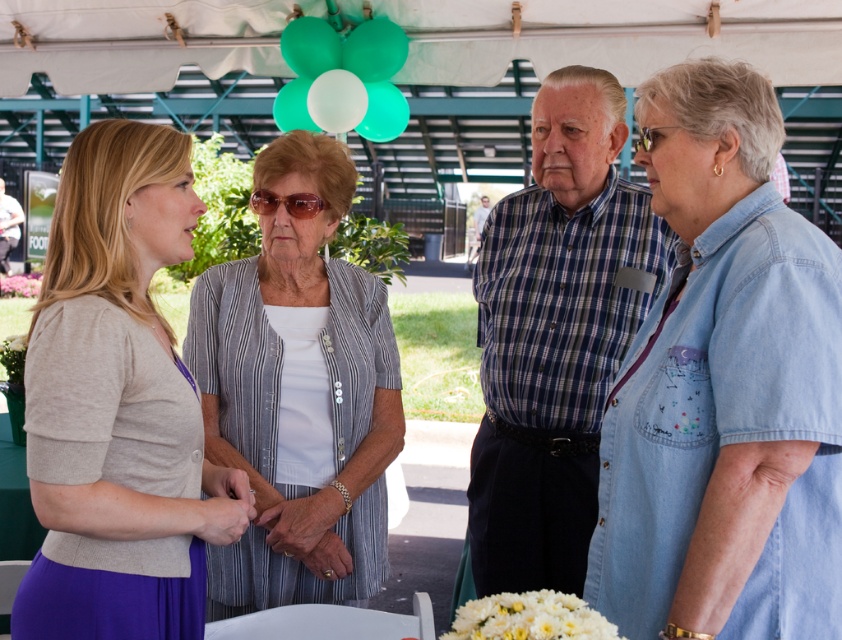
Can you confirm if striped fabric blouse at center is thinner than plaid shirt at center?

No, striped fabric blouse at center is not thinner than plaid shirt at center.

This screenshot has width=842, height=640. What do you see at coordinates (297, 392) in the screenshot? I see `striped fabric blouse at center` at bounding box center [297, 392].

Is point (400, 410) farther from viewer compared to point (499, 312)?

No.

Where is `striped fabric blouse at center`? This screenshot has height=640, width=842. striped fabric blouse at center is located at coordinates (297, 392).

Who is positioned more to the left, matte beige cardigan at left or matte blue shirt at center?

matte blue shirt at center is more to the left.

Between point (30, 632) and point (13, 211), which one is positioned behind?

Positioned behind is point (13, 211).

Who is more forward, (x=45, y=362) or (x=1, y=184)?

Point (x=45, y=362)

In order to click on matte beige cardigan at left in this screenshot , I will do pyautogui.click(x=118, y=404).

Is denim shirt at right above striped fabric blouse at center?

Correct, denim shirt at right is located above striped fabric blouse at center.

Is point (707, 394) closer to viewer compared to point (302, 392)?

Yes, point (707, 394) is in front of point (302, 392).

Locate an element on the screen. The image size is (842, 640). denim shirt at right is located at coordinates (723, 388).